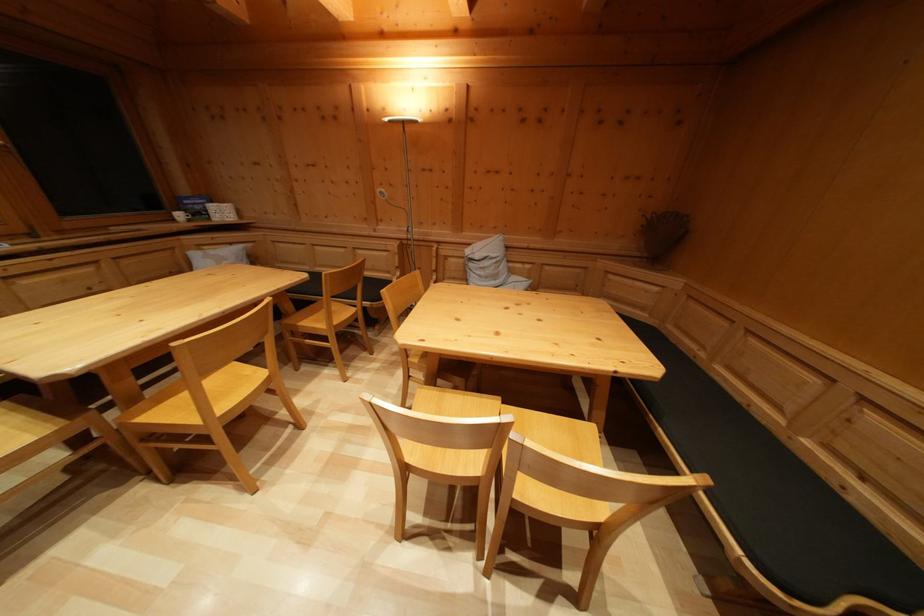
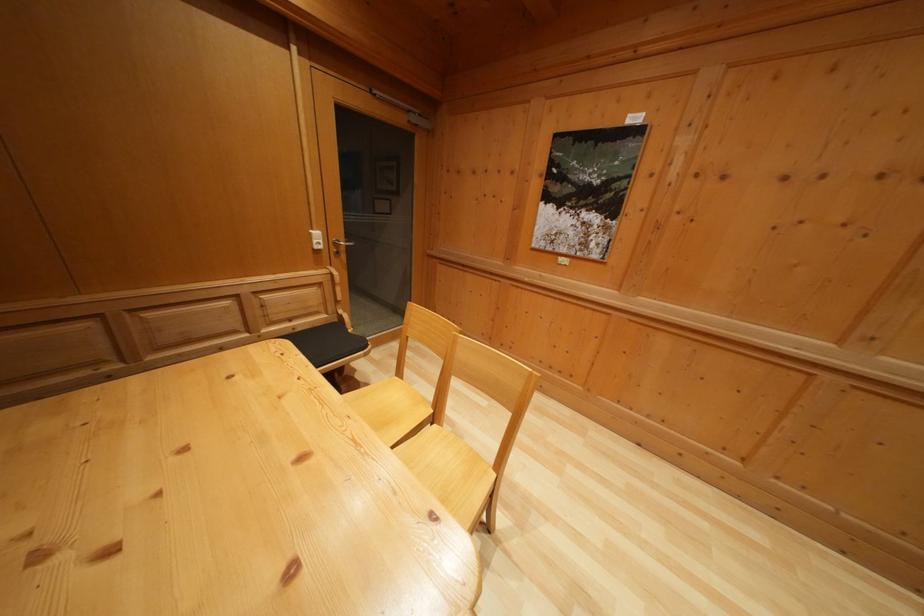
Where in the second image is the point corresponding to (857,506) from the first image?

(305, 336)